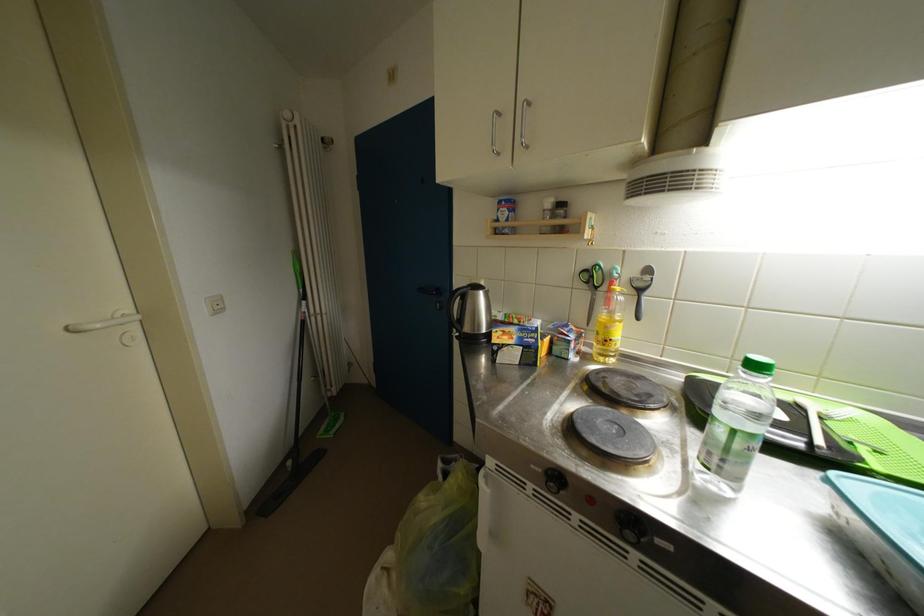
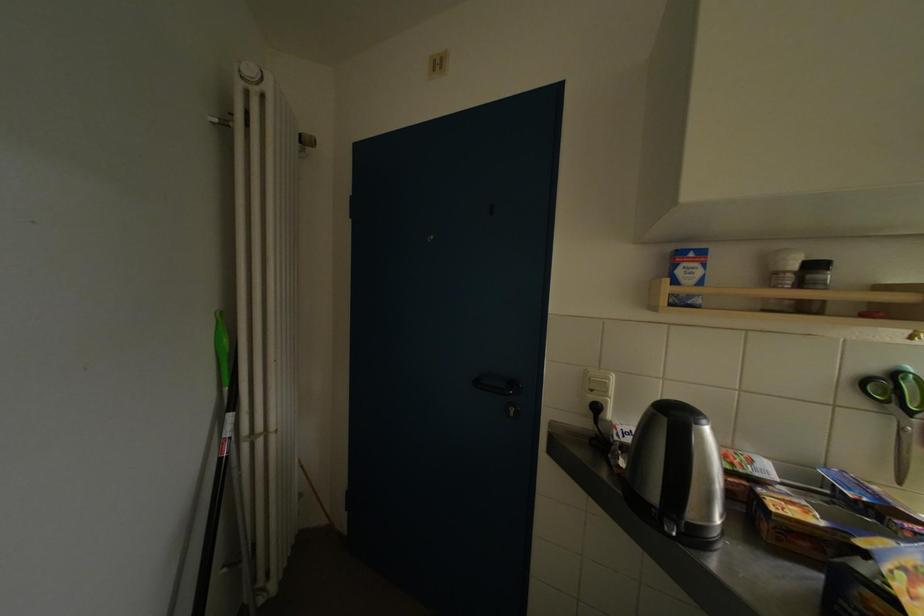
The point at (566, 209) is marked in the first image. Where is the corresponding point in the second image?

(821, 270)